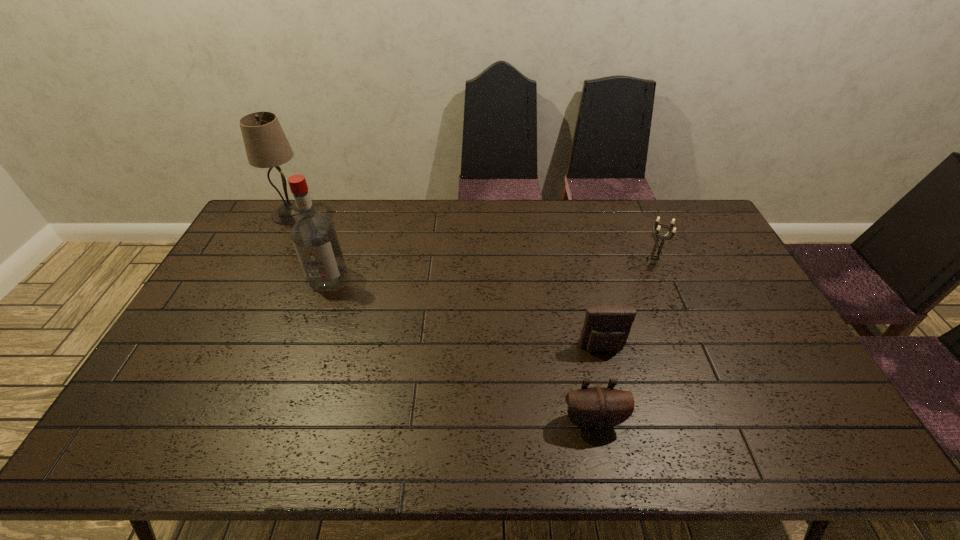
Identify which object is the fourth closest to the lampshade. Please provide its 2D coordinates. Your answer should be formatted as a tuple, i.e. [(x, y)], where the tuple contains the x and y coordinates of a point satisfying the conditions above.

[(654, 256)]

The height and width of the screenshot is (540, 960). I want to click on free spot that satisfies the following two spatial constraints: 1. on the front-facing side of the candle holder; 2. on the left side of the lampshade, so click(x=266, y=262).